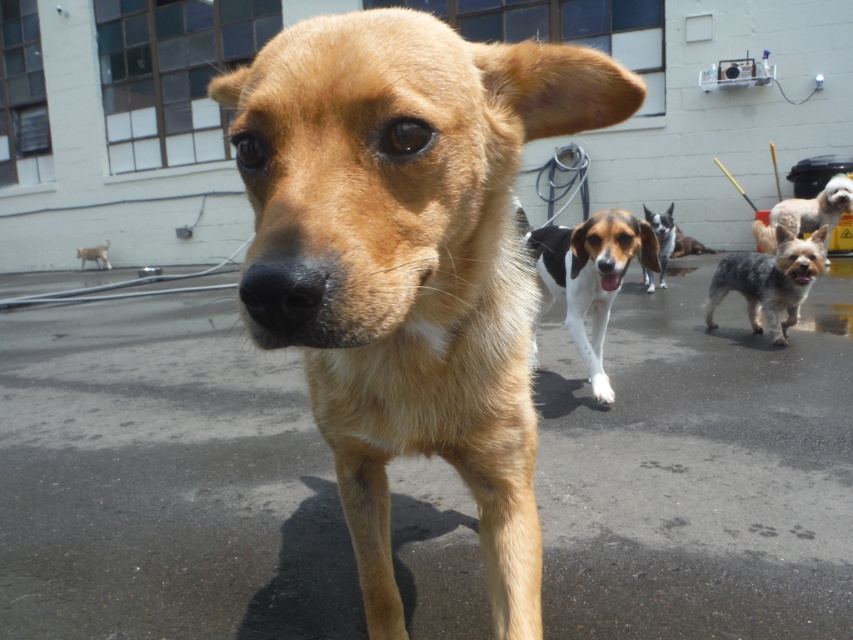
Which of these two, spotted fur dog at center or white and black spotted dog at center, stands taller?

Standing taller between the two is white and black spotted dog at center.

Who is more distant from viewer, (772, 323) or (665, 237)?

Point (665, 237)

Find the location of a particular element. Image resolution: width=853 pixels, height=640 pixels. spotted fur dog at center is located at coordinates (769, 280).

Can you confirm if golden fur beagle at center is positioned to the right of white and black spotted dog at center?

No, golden fur beagle at center is not to the right of white and black spotted dog at center.

Who is taller, golden fur beagle at center or white and black spotted dog at center?

golden fur beagle at center

Between point (311, 348) and point (647, 289), which one is positioned in front?

Point (311, 348) is in front.

Where is `golden fur beagle at center`? This screenshot has height=640, width=853. golden fur beagle at center is located at coordinates (409, 260).

Which is behind, point (786, 214) or point (91, 248)?

The point (91, 248) is behind.

Is point (756, 236) positioned after point (96, 248)?

No, it is not.

Is point (776, 211) in front of point (83, 260)?

Yes.

Where is `short-haired white dog at center`? The image size is (853, 640). short-haired white dog at center is located at coordinates (805, 212).